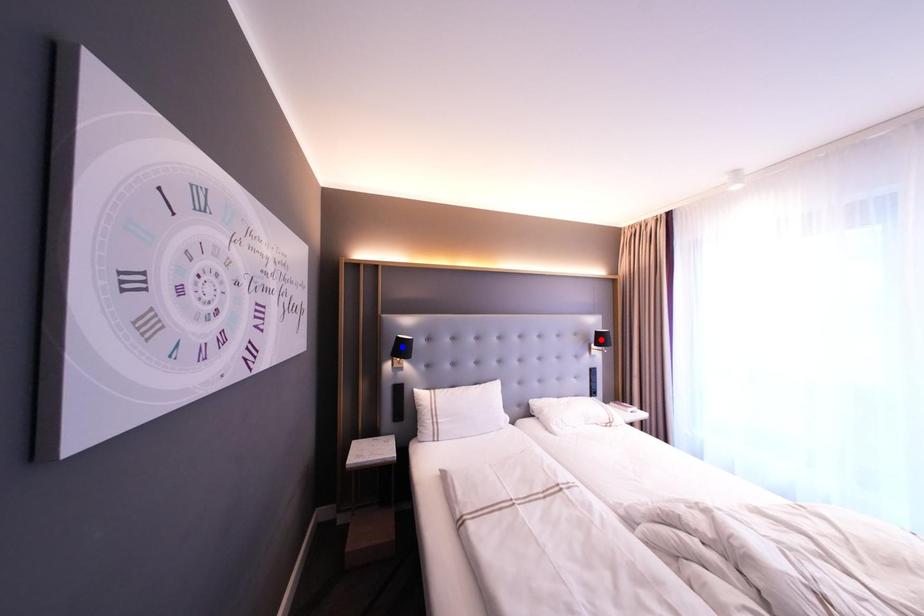
Question: Two points are marked on the image. Which point is closer to the camera?

Choices:
 (A) Blue point is closer.
 (B) Red point is closer.

Answer: (A)